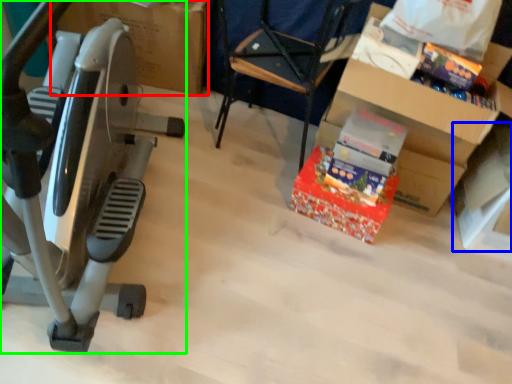
Question: Which object is positioned closest to cardboard box (highlighted by a red box)? Select from box (highlighted by a blue box) and stationary bicycle (highlighted by a green box).

Choices:
 (A) box
 (B) stationary bicycle

Answer: (B)